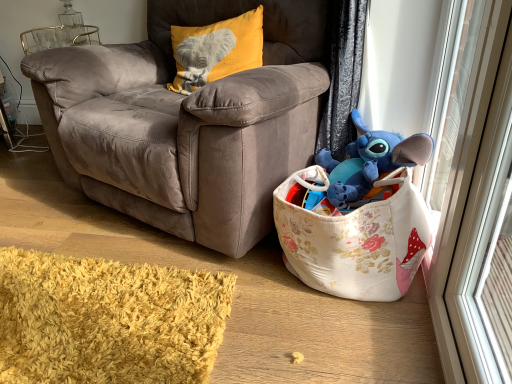
Question: Is transparent glass screen door at right a part of blue plush toy at upper right?

Choices:
 (A) yes
 (B) no

Answer: (B)

Question: Is blue plush toy at upper right further to camera compared to transparent glass screen door at right?

Choices:
 (A) yes
 (B) no

Answer: (A)

Question: Does blue plush toy at upper right lie in front of transparent glass screen door at right?

Choices:
 (A) yes
 (B) no

Answer: (B)

Question: Can you confirm if blue plush toy at upper right is bigger than transparent glass screen door at right?

Choices:
 (A) yes
 (B) no

Answer: (A)

Question: From the image's perspective, would you say blue plush toy at upper right is shown under transparent glass screen door at right?

Choices:
 (A) no
 (B) yes

Answer: (B)

Question: Would you say blue plush toy at upper right is outside transparent glass screen door at right?

Choices:
 (A) no
 (B) yes

Answer: (B)

Question: Would you say transparent glass screen door at right is outside blue plush toy at upper right?

Choices:
 (A) no
 (B) yes

Answer: (B)

Question: Is transparent glass screen door at right touching blue plush toy at upper right?

Choices:
 (A) yes
 (B) no

Answer: (B)

Question: From a real-world perspective, is transparent glass screen door at right on blue plush toy at upper right?

Choices:
 (A) yes
 (B) no

Answer: (A)

Question: From the image's perspective, would you say transparent glass screen door at right is shown under blue plush toy at upper right?

Choices:
 (A) no
 (B) yes

Answer: (A)

Question: Would you say transparent glass screen door at right contains blue plush toy at upper right?

Choices:
 (A) no
 (B) yes

Answer: (A)

Question: Is transparent glass screen door at right far from blue plush toy at upper right?

Choices:
 (A) yes
 (B) no

Answer: (B)

Question: Can you confirm if velvet yellow pillow with elephant design at upper left is taller than transparent glass screen door at right?

Choices:
 (A) yes
 (B) no

Answer: (B)